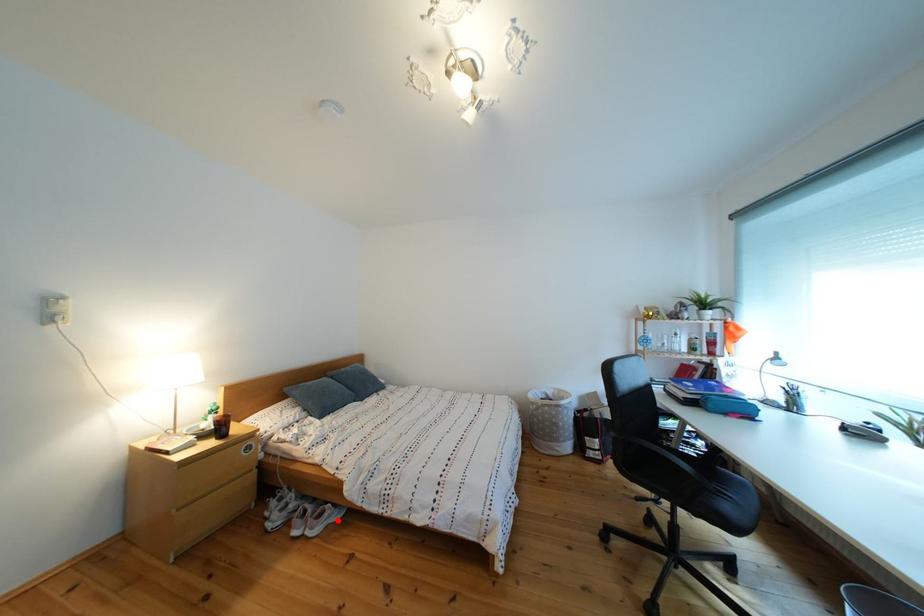
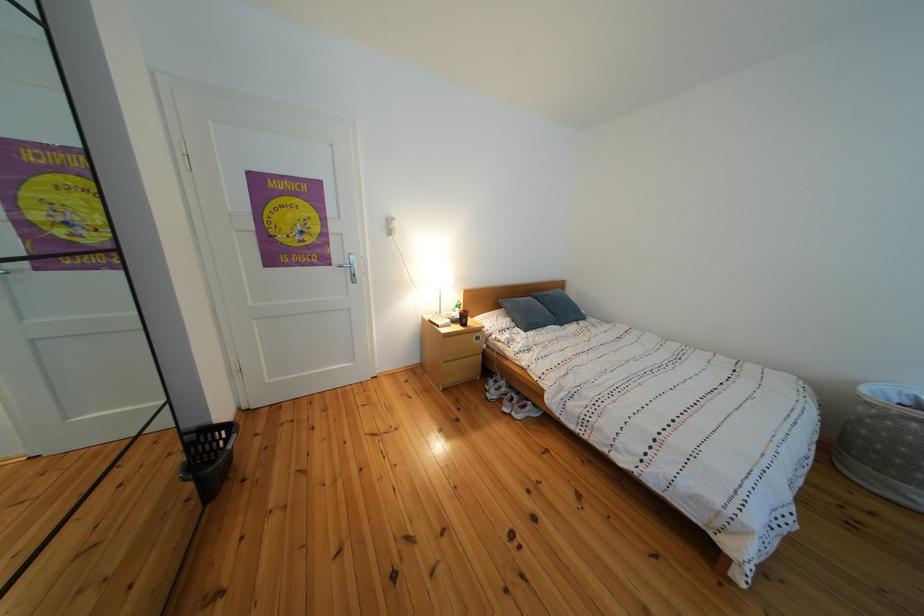
Where in the second image is the point corresponding to the highlighted location from the first image?

(540, 414)